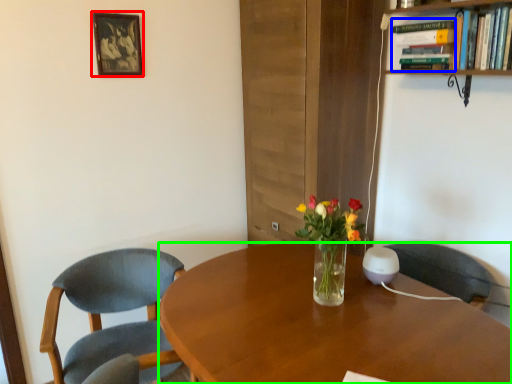
Question: Which is nearer to the picture frame (highlighted by a red box)? book (highlighted by a blue box) or desk (highlighted by a green box).

Choices:
 (A) book
 (B) desk

Answer: (A)